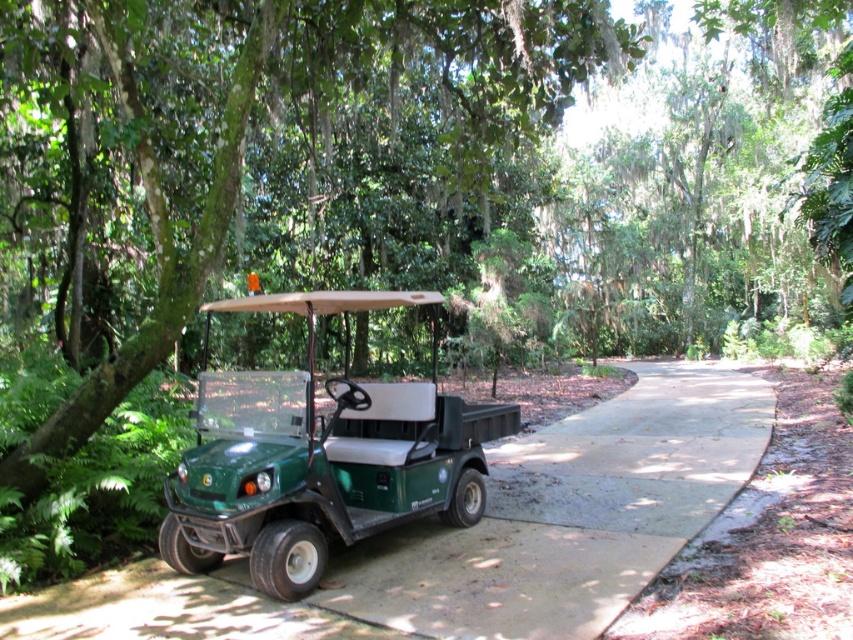
Measure the distance between point [231,614] and camera.

A distance of 4.44 meters exists between point [231,614] and camera.

Which is above, green rubber pavement at center or green matte golf cart at center?

green matte golf cart at center

Identify the location of green rubber pavement at center. The image size is (853, 640). (480, 536).